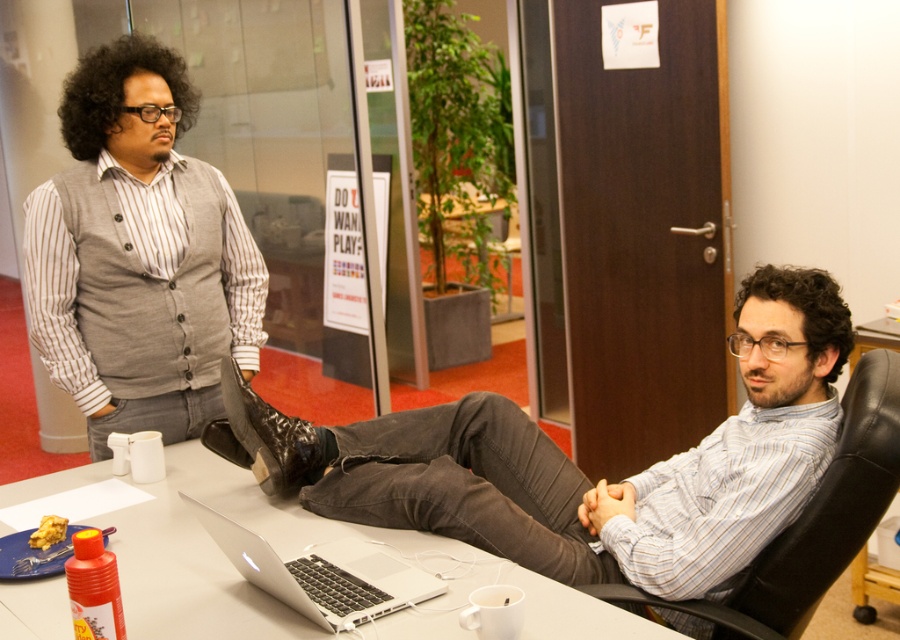
You are a delivery person who needs to place a small package on the table between the black leather swivel chair at center and the shiny black boot at center. Can you fit the package there without moving either object?

The black leather swivel chair at center is below the shiny black boot at center, so there is space between them to place the package without moving either object.

You are organizing the office space and need to place a new item between the white glossy table at center and the silver metallic laptop at center. Based on their positions, which side of the laptop should you place the item to ensure it is between them?

The white glossy table at center is to the left of the silver metallic laptop at center, so placing the item to the left side of the laptop would position it between the two objects.